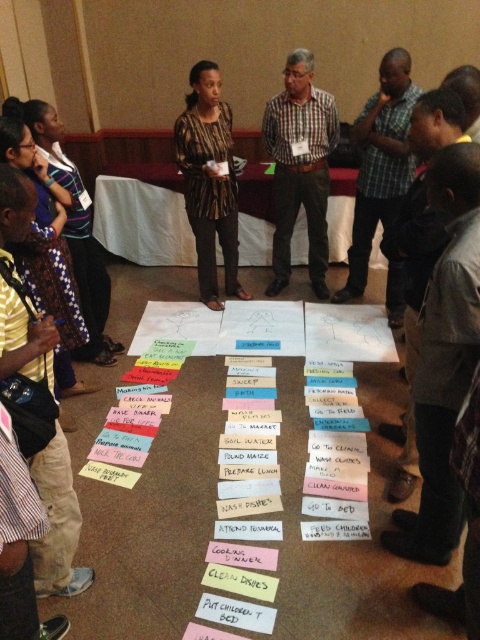
You are organizing a team meeting in this conference room and need to ensure everyone has enough space. The yellow striped shirt at left is worn by a team member who requires 1 meter of personal space. Can the checkered fabric shirt at center, which is wider, accommodate this requirement?

The yellow striped shirt at left is narrower than the checkered fabric shirt at center. Since the checkered fabric shirt at center is wider, the team member wearing it would need more space than the 1 meter required by the yellow striped shirt at left. Therefore, the 1 meter space might not be sufficient for the checkered fabric shirt at center wearer.

You are standing in the conference room and need to move from the beige wall to the red paneling wall. There are two points marked on the floor mat labeled as point (x=369, y=188) and point (x=235, y=262). Which point should you step on first to reach the red paneling wall more directly?

Point (x=369, y=188) is in front of point (x=235, y=262), so stepping on point (x=369, y=188) first would lead you more directly toward the red paneling wall.

You are a participant in the meeting and need to place a new document on the floor mat. The document is 12 inches tall. There are two shirts on the mat already, the checkered fabric shirt at center and the patterned fabric shirt at center. Which shirt can the document fit under without overlapping vertically?

The document can fit under the checkered fabric shirt at center because it is much taller than the patterned fabric shirt at center, providing enough vertical space.